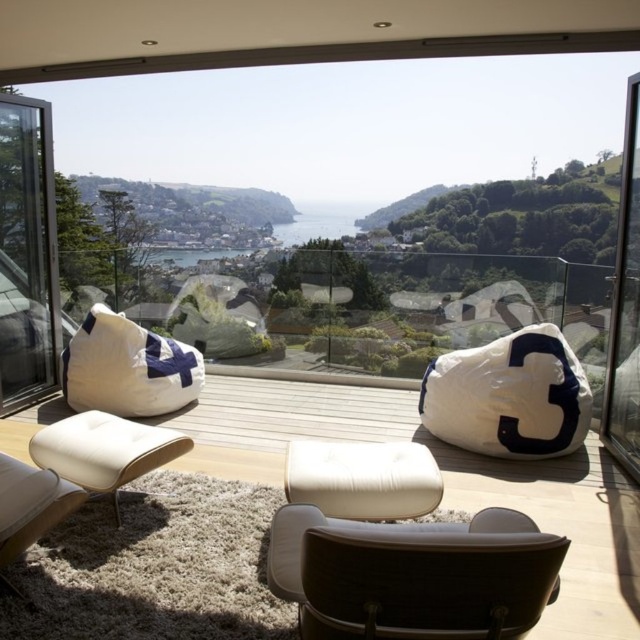
Identify the location of transparent glass window at center. Image resolution: width=640 pixels, height=640 pixels. (349, 195).

Which is in front, point (216, 348) or point (8, 308)?

Point (8, 308) is in front.

Is point (173, 269) positioned behind point (51, 353)?

Yes, point (173, 269) is behind point (51, 353).

Identify the location of transparent glass window at center. This screenshot has height=640, width=640. (349, 195).

Is white fabric bean bag at center above transparent glass door at right?

No.

Between white fabric bean bag at center and transparent glass door at right, which one is positioned higher?

Positioned higher is transparent glass door at right.

Measure the distance between white fabric bean bag at center and camera.

3.46 meters

The width and height of the screenshot is (640, 640). In order to click on white fabric bean bag at center in this screenshot , I will do `click(508, 396)`.

Does transparent glass window at center appear under white fabric bean bag at center?

No.

Based on the photo, who is positioned more to the right, transparent glass window at center or white fabric bean bag at center?

white fabric bean bag at center is more to the right.

Which is in front, point (316, 340) or point (541, 442)?

Positioned in front is point (541, 442).

The image size is (640, 640). I want to click on transparent glass window at center, so pyautogui.click(x=349, y=195).